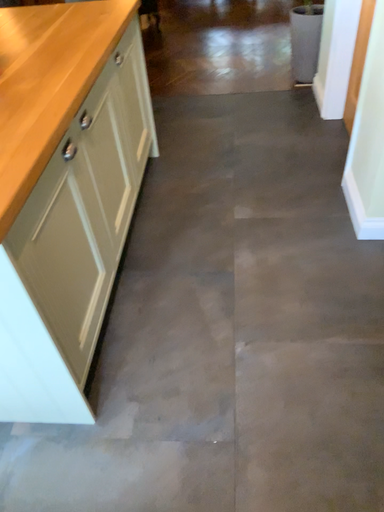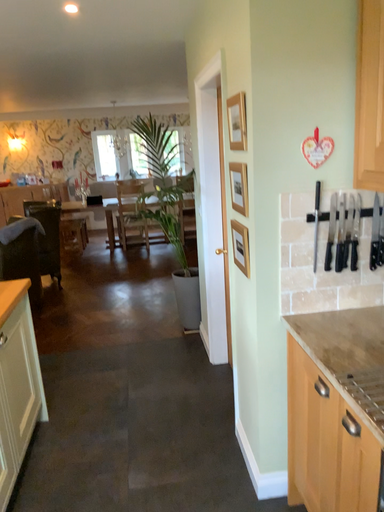
Question: How did the camera likely rotate when shooting the video?

Choices:
 (A) rotated upward
 (B) rotated downward

Answer: (A)